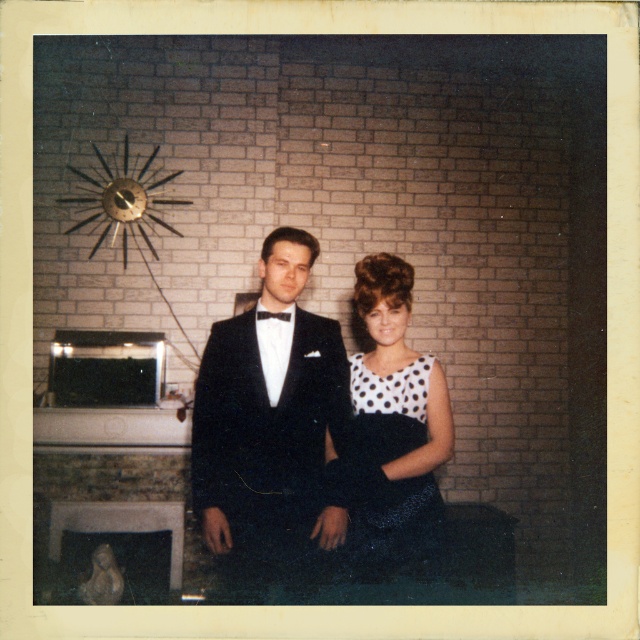
Which is in front, point (320, 433) or point (310, 536)?

Point (310, 536)

Does black satin tuxedo at center appear on the right side of white dotted dress at center?

No, black satin tuxedo at center is not to the right of white dotted dress at center.

Where is `black satin tuxedo at center`? black satin tuxedo at center is located at coordinates (268, 420).

Identify the location of black satin tuxedo at center. 268,420.

Does black satin tuxedo at center have a smaller size compared to black satin bow tie at center?

No.

Can you confirm if black satin tuxedo at center is positioned to the right of black satin bow tie at center?

Incorrect, black satin tuxedo at center is not on the right side of black satin bow tie at center.

Measure the distance between black satin tuxedo at center and camera.

black satin tuxedo at center is 2.47 meters away from camera.

Where is `black satin tuxedo at center`? The image size is (640, 640). black satin tuxedo at center is located at coordinates (268, 420).

Can you confirm if white dotted dress at center is smaller than black satin bow tie at center?

No.

Looking at this image, how much distance is there between white dotted dress at center and black satin bow tie at center?

white dotted dress at center and black satin bow tie at center are 18.30 inches apart from each other.

Where is `white dotted dress at center`? white dotted dress at center is located at coordinates (388, 432).